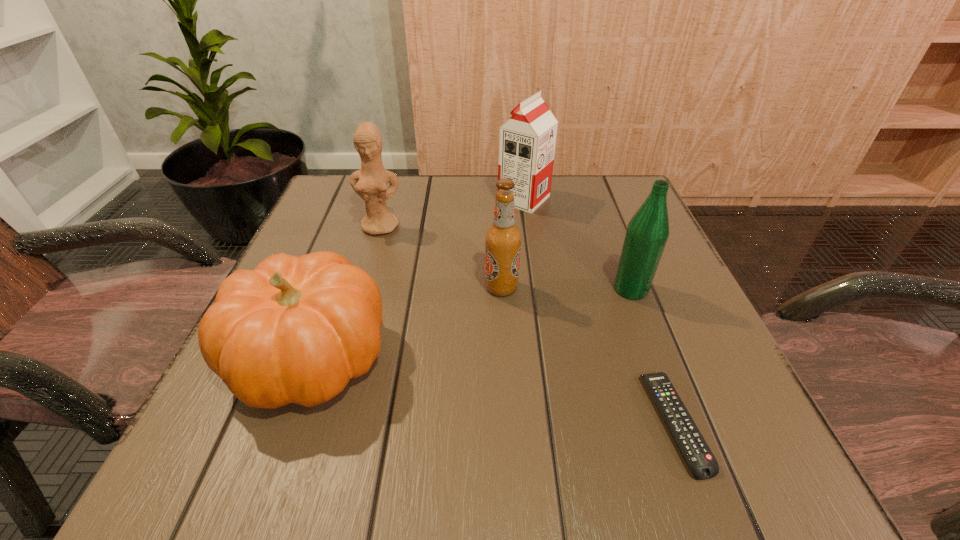
Where is `soya milk`? This screenshot has width=960, height=540. soya milk is located at coordinates (527, 140).

Find the location of a particular element. The image size is (960, 540). the second farthest object is located at coordinates (370, 182).

Find the location of a particular element. The width and height of the screenshot is (960, 540). bottle is located at coordinates (647, 232).

Where is `beer bottle`? beer bottle is located at coordinates (503, 239).

Locate an element on the screen. The width and height of the screenshot is (960, 540). the second shortest object is located at coordinates (295, 329).

Locate an element on the screen. The image size is (960, 540). remote control is located at coordinates [702, 463].

Locate an element on the screen. The image size is (960, 540). free space located 0.310m on the front of the farthest object is located at coordinates (540, 311).

Where is `free location located on the front-facing side of the second farthest object`? free location located on the front-facing side of the second farthest object is located at coordinates (372, 254).

What are the coordinates of `free location located on the left of the bottle` in the screenshot? It's located at (493, 289).

The height and width of the screenshot is (540, 960). What are the coordinates of `free location located 0.140m on the front label of the beer bottle` in the screenshot? It's located at (408, 288).